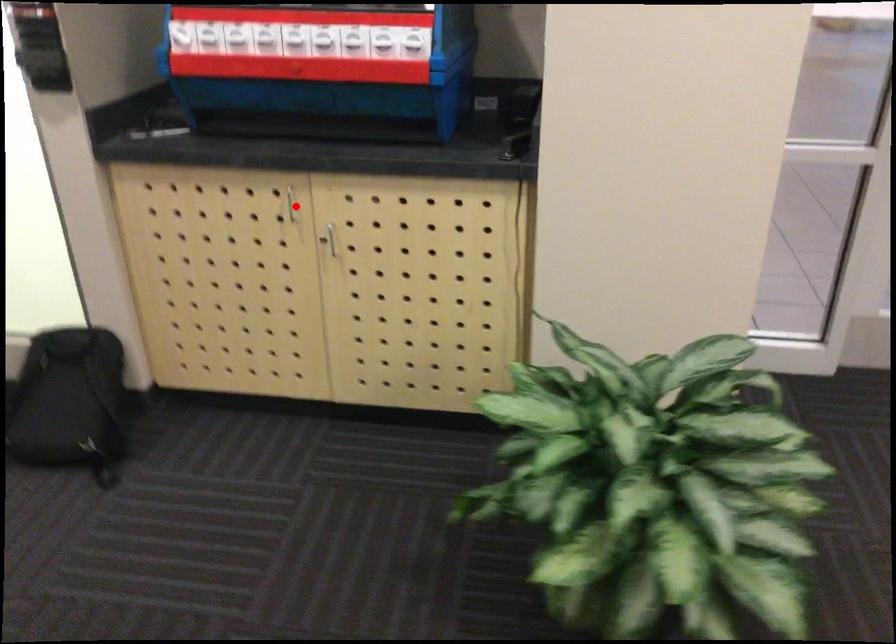
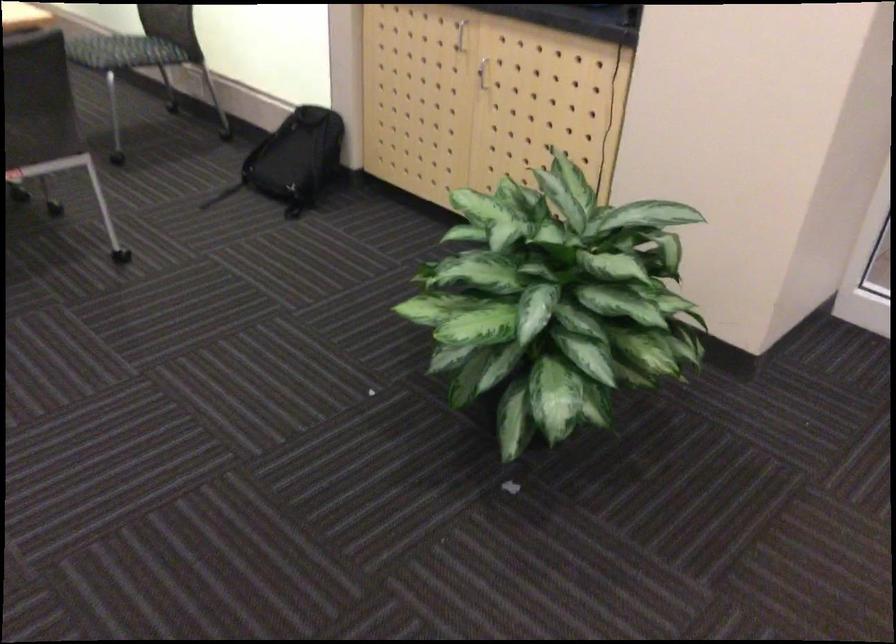
Locate, in the second image, the point that corresponds to the highlighted location in the first image.

(460, 35)